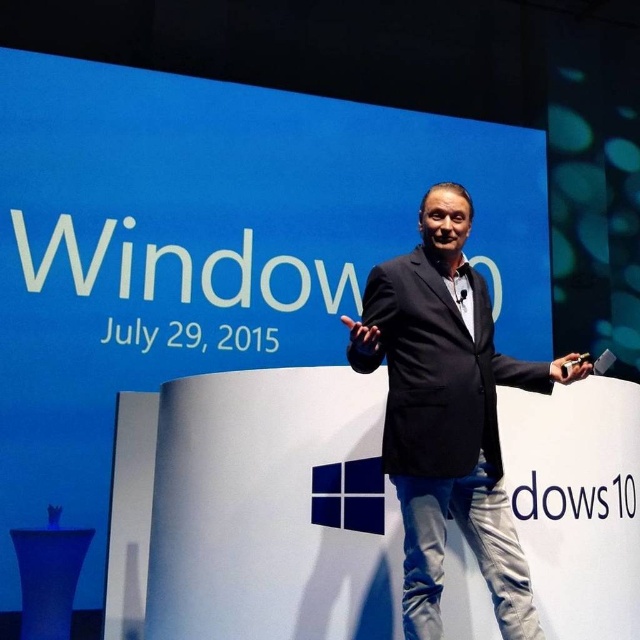
You are an event organizer who needs to determine the visibility of the black matte suit at center and the matte black remote at center from the back of the room. Based on their sizes, which object is more likely to be seen clearly from a distance?

The black matte suit at center has a greater height compared to the matte black remote at center, so the black matte suit at center is more likely to be seen clearly from a distance.